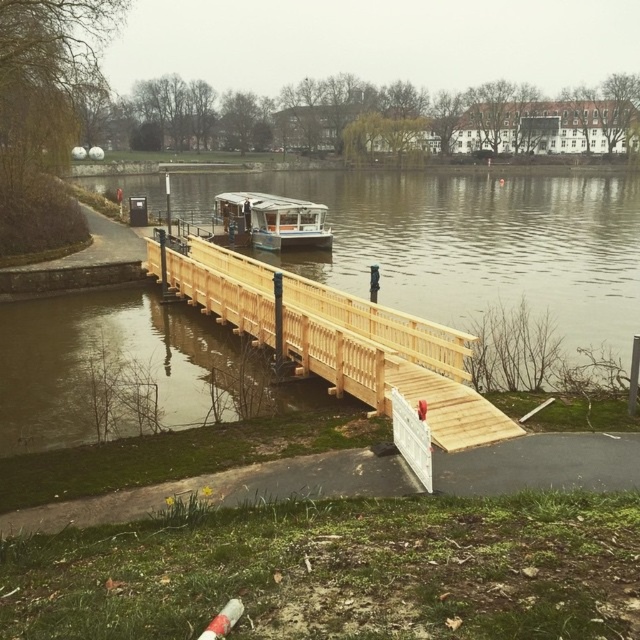
You are planning to cross the brown wooden bridge at center to reach the green plastic boat at center. Given that the distance between them is 112.45 feet, can you estimate how far you need to walk from the bridge to the boat?

The brown wooden bridge at center and green plastic boat at center are 112.45 feet apart, so you need to walk approximately 112.45 feet from the bridge to the boat.

You are standing on the riverside and want to cross to the other side. You see a brown wooden bridge at center and a natural wood bridge at center. Which bridge is located to the right when facing the river?

The brown wooden bridge at center is positioned on the right side of natural wood bridge at center, so when facing the river, the brown wooden bridge at center would be to the right of the natural wood bridge at center.